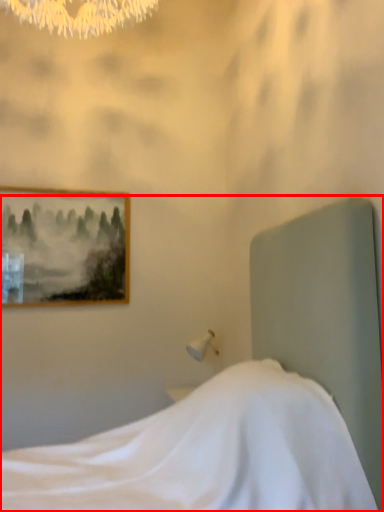
Question: From the image, what is the correct spatial relationship of bed (annotated by the red box) in relation to picture frame?

Choices:
 (A) right
 (B) left

Answer: (A)